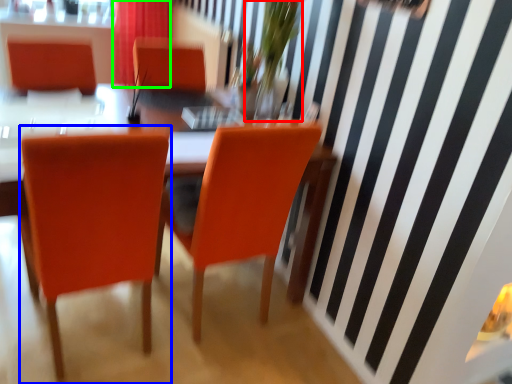
Question: Based on their relative distances, which object is nearer to floral arrangement (highlighted by a red box)? Choose from chair (highlighted by a blue box) and curtain (highlighted by a green box).

Choices:
 (A) chair
 (B) curtain

Answer: (A)